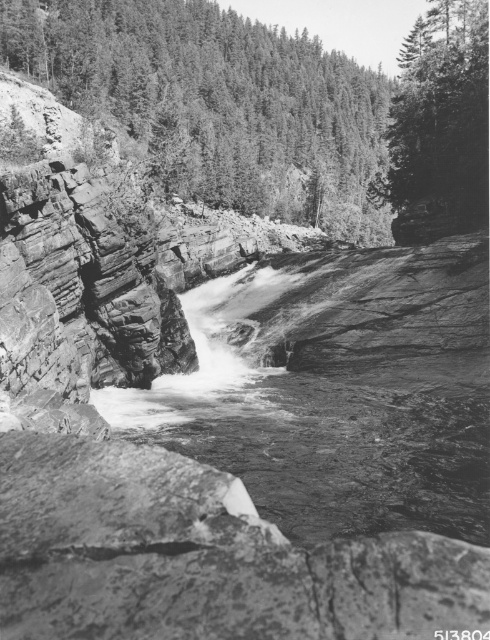
Question: Among these objects, which one is farthest from the camera?

Choices:
 (A) dark green textured tree at upper center
 (B) smooth green tree at upper right

Answer: (A)

Question: Which object appears farthest from the camera in this image?

Choices:
 (A) smooth rock water at center
 (B) dark green textured tree at upper center
 (C) smooth green tree at upper right

Answer: (B)

Question: Which point is farther from the camera taking this photo?

Choices:
 (A) (251, 294)
 (B) (65, 74)

Answer: (B)

Question: Can you confirm if smooth rock water at center is positioned below smooth green tree at upper right?

Choices:
 (A) no
 (B) yes

Answer: (B)

Question: Can you confirm if smooth rock water at center is positioned below smooth green tree at upper right?

Choices:
 (A) yes
 (B) no

Answer: (A)

Question: Is smooth rock water at center positioned before smooth green tree at upper right?

Choices:
 (A) yes
 (B) no

Answer: (A)